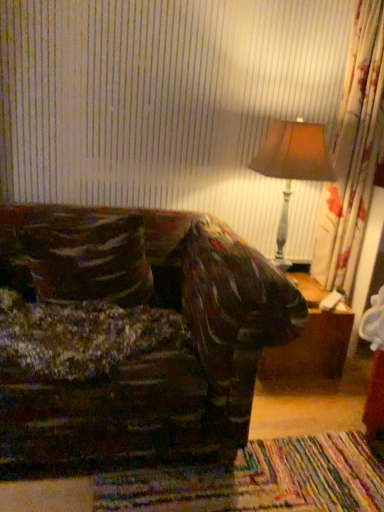
Question: Can you confirm if matte brown lampshade at upper right is shorter than velvety brown throw pillow at left?

Choices:
 (A) yes
 (B) no

Answer: (B)

Question: Is matte brown lampshade at upper right further to camera compared to velvety brown throw pillow at left?

Choices:
 (A) yes
 (B) no

Answer: (A)

Question: Is velvety brown throw pillow at left a part of matte brown lampshade at upper right?

Choices:
 (A) yes
 (B) no

Answer: (B)

Question: Considering the relative sizes of matte brown lampshade at upper right and velvety brown throw pillow at left in the image provided, is matte brown lampshade at upper right thinner than velvety brown throw pillow at left?

Choices:
 (A) no
 (B) yes

Answer: (A)

Question: From a real-world perspective, is matte brown lampshade at upper right on velvety brown throw pillow at left?

Choices:
 (A) no
 (B) yes

Answer: (B)

Question: From the image's perspective, is matte brown lampshade at upper right below velvety brown throw pillow at left?

Choices:
 (A) yes
 (B) no

Answer: (B)

Question: Is velvety brown throw pillow at left positioned before matte brown lampshade at upper right?

Choices:
 (A) yes
 (B) no

Answer: (A)

Question: Is velvety brown throw pillow at left positioned with its back to matte brown lampshade at upper right?

Choices:
 (A) no
 (B) yes

Answer: (A)

Question: Is velvety brown throw pillow at left next to matte brown lampshade at upper right and touching it?

Choices:
 (A) yes
 (B) no

Answer: (B)

Question: Is matte brown lampshade at upper right inside velvety brown throw pillow at left?

Choices:
 (A) no
 (B) yes

Answer: (A)

Question: Is velvety brown throw pillow at left at the left side of matte brown lampshade at upper right?

Choices:
 (A) yes
 (B) no

Answer: (A)

Question: From a real-world perspective, is velvety brown throw pillow at left on matte brown lampshade at upper right?

Choices:
 (A) yes
 (B) no

Answer: (B)

Question: Does velvety brown throw pillow at left have a greater width compared to brown wooden table at lower right?

Choices:
 (A) no
 (B) yes

Answer: (A)